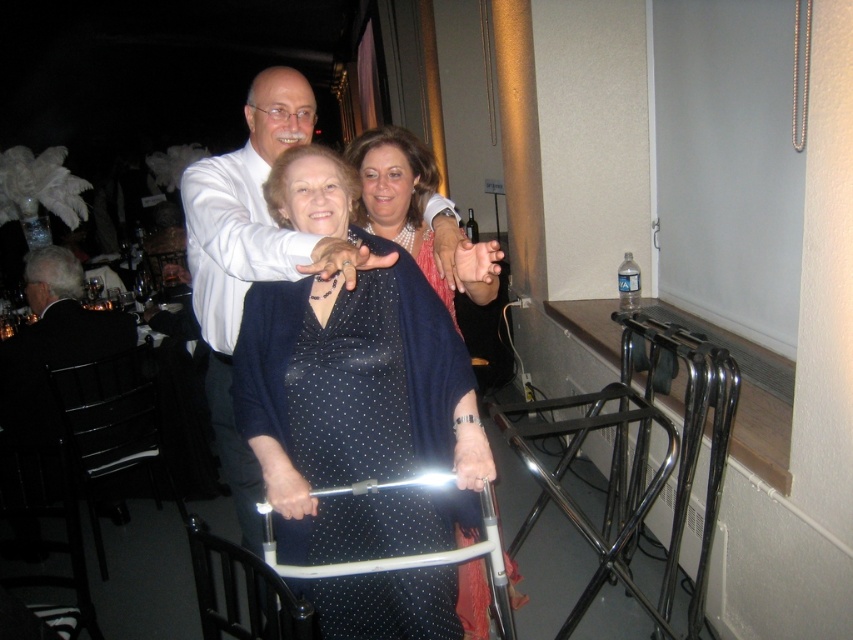
You are a photographer setting up for a group photo. You need to ensure that the polka dot fabric walker at center and the black leather chair at left are both visible in the frame. Given their sizes, which object should you prioritize positioning closer to the camera to maintain detail in the photo?

The polka dot fabric walker at center is smaller than the black leather chair at left. To ensure both are visible with clear details, prioritize positioning the smaller polka dot fabric walker at center closer to the camera so its details are not lost compared to the larger chair.

You are a photographer at a formal event. You need to position a tripod between the polka dot fabric walker at center and the black leather chair at left. Based on their positions, can the tripod be placed directly between them without moving either object?

The polka dot fabric walker at center is below the black leather chair at left, so placing the tripod directly between them would require positioning it in the space between the lower walker and the higher chair. Since they are vertically aligned, the tripod can be placed between them horizontally as long as there is enough horizontal space, but the description only mentions their vertical relationship. The answer should focus on the vertical positioning provided. However, since the question asks about the

Looking at this image, you are a photographer at a formal event and need to adjust your camera focus. The polka dot fabric walker at center and the black leather chair at left are in the scene. Which object is nearer to your camera lens?

The polka dot fabric walker at center is closer to the viewer than the black leather chair at left, so the photographer should focus on the polka dot fabric walker at center as it is nearer to the camera lens.